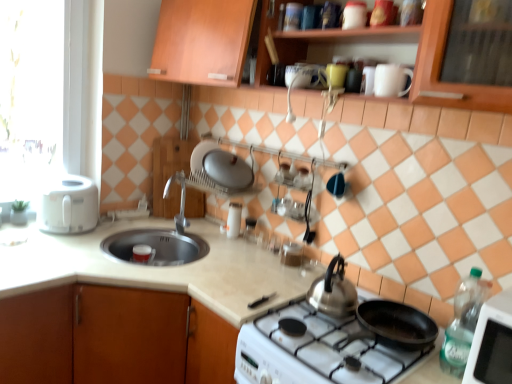
Where is `free space to the left of metallic silver toaster at upper left, the third appliance viewed from the front`? Image resolution: width=512 pixels, height=384 pixels. free space to the left of metallic silver toaster at upper left, the third appliance viewed from the front is located at coordinates (214, 235).